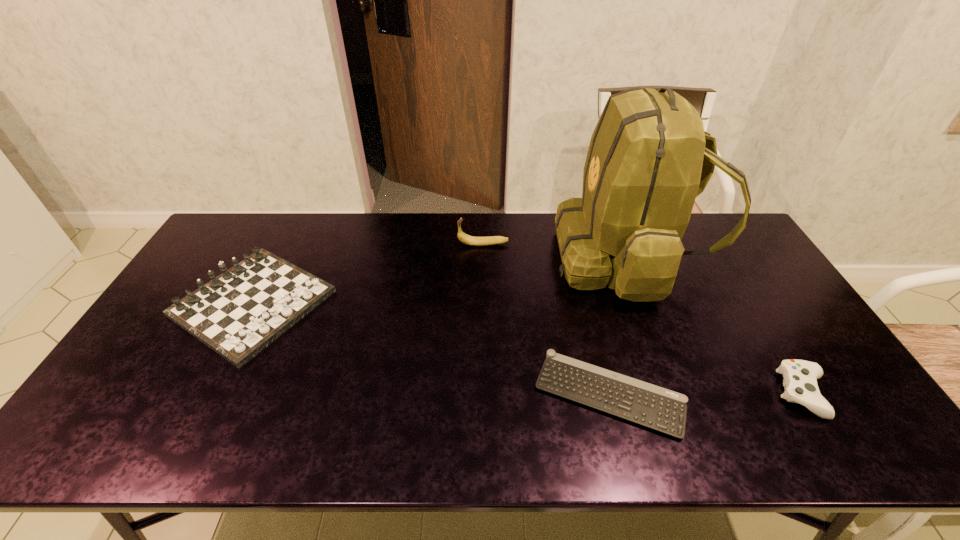
The width and height of the screenshot is (960, 540). Identify the location of computer keyboard positioned at the near edge. (651, 406).

Where is `object positioned at the left edge`? object positioned at the left edge is located at coordinates (239, 313).

The width and height of the screenshot is (960, 540). I want to click on object located in the right edge section of the desktop, so click(800, 377).

You are a GUI agent. You are given a task and a screenshot of the screen. Output one action in this format:
    pyautogui.click(x=<x>, y=<y>)
    Task: Click on the object that is at the far left corner
    The width and height of the screenshot is (960, 540).
    Given the screenshot: What is the action you would take?
    pyautogui.click(x=239, y=313)

The image size is (960, 540). Identify the location of object that is at the near right corner. (800, 377).

Locate an element on the screen. This screenshot has width=960, height=540. blank space at the far edge of the desktop is located at coordinates (526, 249).

Find the location of a particular element. This screenshot has height=540, width=960. vacant space at the near edge is located at coordinates (500, 438).

The width and height of the screenshot is (960, 540). Find the location of `vacant space at the right edge`. vacant space at the right edge is located at coordinates (729, 281).

Where is `free space at the far right corner of the desktop`? The width and height of the screenshot is (960, 540). free space at the far right corner of the desktop is located at coordinates (735, 248).

This screenshot has width=960, height=540. I want to click on unoccupied area between the backpack and the second shortest object, so click(x=715, y=325).